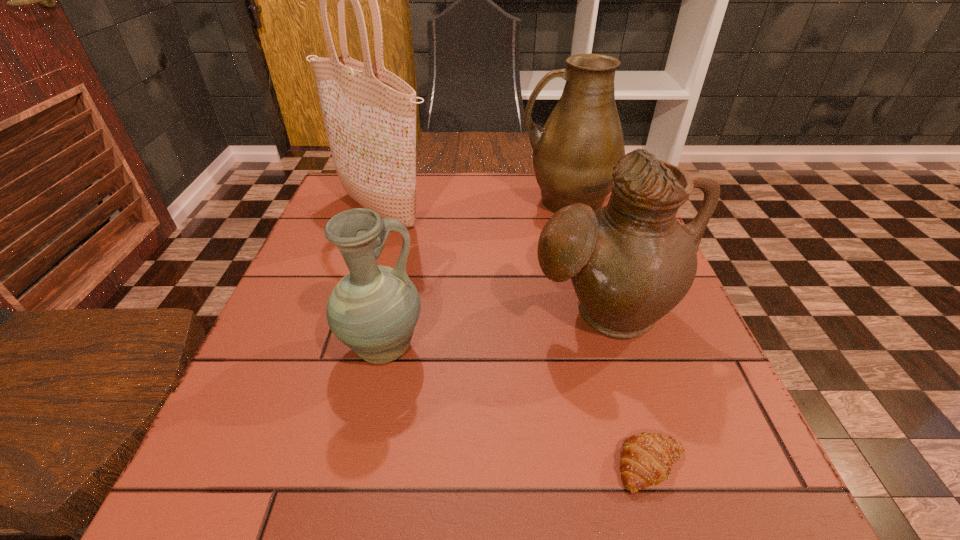
Locate an element on the screen. Image resolution: width=960 pixels, height=540 pixels. object that is the second closest to the fourth tallest object is located at coordinates (369, 113).

In order to click on pitcher that is the closest one to the farthest pitcher in this screenshot , I will do `click(631, 262)`.

Select which pitcher is the closest to the second shortest object. Please provide its 2D coordinates. Your answer should be formatted as a tuple, i.e. [(x, y)], where the tuple contains the x and y coordinates of a point satisfying the conditions above.

[(631, 262)]

Where is `blank area in the image that satisfies the following two spatial constraints: 1. on the handle side of the shortest object; 2. on the right side of the shortest pitcher`? The image size is (960, 540). blank area in the image that satisfies the following two spatial constraints: 1. on the handle side of the shortest object; 2. on the right side of the shortest pitcher is located at coordinates (358, 465).